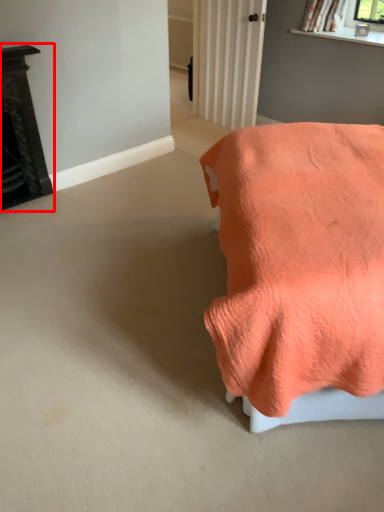
Question: From the image's perspective, where is furniture (annotated by the red box) located relative to furniture?

Choices:
 (A) above
 (B) below

Answer: (A)